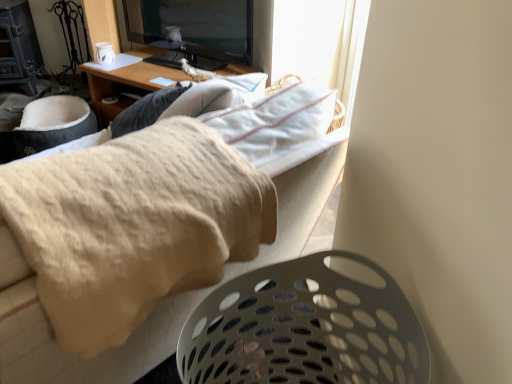
Question: Considering the relative sizes of beige fabric couch at upper center and wooden desk at upper center in the image provided, is beige fabric couch at upper center shorter than wooden desk at upper center?

Choices:
 (A) no
 (B) yes

Answer: (A)

Question: Is beige fabric couch at upper center to the right of wooden desk at upper center from the viewer's perspective?

Choices:
 (A) yes
 (B) no

Answer: (A)

Question: Would you say beige fabric couch at upper center contains wooden desk at upper center?

Choices:
 (A) yes
 (B) no

Answer: (B)

Question: Is beige fabric couch at upper center positioned with its back to wooden desk at upper center?

Choices:
 (A) no
 (B) yes

Answer: (A)

Question: Can you confirm if beige fabric couch at upper center is bigger than wooden desk at upper center?

Choices:
 (A) no
 (B) yes

Answer: (A)

Question: From the image's perspective, is beige fabric couch at upper center located beneath wooden desk at upper center?

Choices:
 (A) no
 (B) yes

Answer: (B)

Question: From a real-world perspective, does beige fabric couch at upper center sit lower than white perforated laundry basket at lower right?

Choices:
 (A) yes
 (B) no

Answer: (B)

Question: Is beige fabric couch at upper center oriented away from white perforated laundry basket at lower right?

Choices:
 (A) no
 (B) yes

Answer: (B)

Question: Is beige fabric couch at upper center not near white perforated laundry basket at lower right?

Choices:
 (A) no
 (B) yes

Answer: (A)

Question: Can we say beige fabric couch at upper center lies outside white perforated laundry basket at lower right?

Choices:
 (A) yes
 (B) no

Answer: (A)

Question: Is beige fabric couch at upper center at the left side of white perforated laundry basket at lower right?

Choices:
 (A) no
 (B) yes

Answer: (B)

Question: Considering the relative sizes of beige fabric couch at upper center and white perforated laundry basket at lower right in the image provided, is beige fabric couch at upper center shorter than white perforated laundry basket at lower right?

Choices:
 (A) yes
 (B) no

Answer: (A)

Question: Is wooden desk at upper center shorter than white perforated laundry basket at lower right?

Choices:
 (A) no
 (B) yes

Answer: (B)